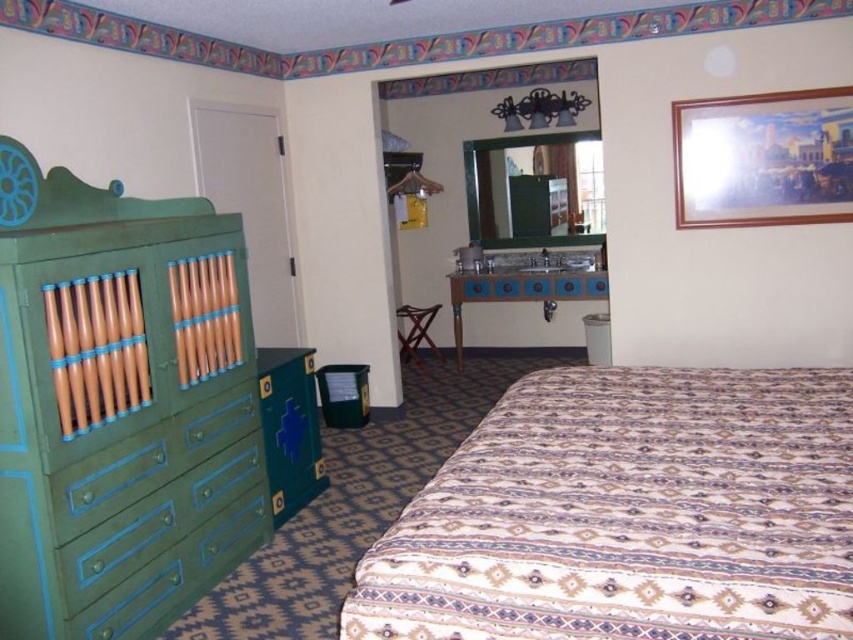
You are a guest in this room and want to place a small lamp on the green painted wood dresser at left and the green matte drawer at left. Which surface has more space available for placing items?

The green painted wood dresser at left is positioned on the left side of the green matte drawer at left, so the green painted wood dresser at left likely has more space available for placing items.

You are a guest in this room and want to place a tall lamp on the tallest object available. Which object should you choose between the patterned fabric bed at lower right and the green painted wood dresser at left?

The green painted wood dresser at left is taller than the patterned fabric bed at lower right, so you should place the tall lamp on the green painted wood dresser at left.